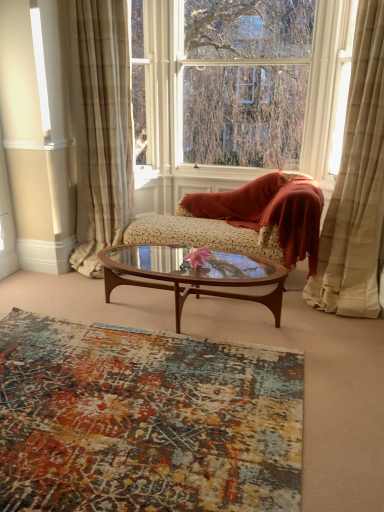
What do you see at coordinates (101, 128) in the screenshot? The height and width of the screenshot is (512, 384). I see `beige plaid curtain at left, the first curtain from the left` at bounding box center [101, 128].

What is the approximate height of beige textured curtain at right, which is the first curtain in right-to-left order?

It is 6.88 feet.

Describe the element at coordinates (144, 420) in the screenshot. This screenshot has height=512, width=384. I see `textured multicolored rug at lower center` at that location.

Where is `clear glass window at upper center`? Image resolution: width=384 pixels, height=512 pixels. clear glass window at upper center is located at coordinates (238, 90).

This screenshot has height=512, width=384. Describe the element at coordinates (248, 219) in the screenshot. I see `velvet floral-patterned chaise lounge at center` at that location.

Locate an element on the screen. This screenshot has width=384, height=512. beige plaid curtain at left, the first curtain from the left is located at coordinates (101, 128).

From the picture: Can you confirm if brown wood/glass coffee table at center is positioned to the left of clear glass window at upper center?

Correct, you'll find brown wood/glass coffee table at center to the left of clear glass window at upper center.

Measure the distance between brown wood/glass coffee table at center and clear glass window at upper center.

brown wood/glass coffee table at center and clear glass window at upper center are 4.52 feet apart from each other.

Considering the relative sizes of brown wood/glass coffee table at center and clear glass window at upper center in the image provided, is brown wood/glass coffee table at center thinner than clear glass window at upper center?

Incorrect, the width of brown wood/glass coffee table at center is not less than that of clear glass window at upper center.

Is brown wood/glass coffee table at center touching clear glass window at upper center?

No, brown wood/glass coffee table at center is not in contact with clear glass window at upper center.

Between velvet floral-patterned chaise lounge at center and brown wood/glass coffee table at center, which one has more height?

velvet floral-patterned chaise lounge at center.

Which object is further away from the camera taking this photo, velvet floral-patterned chaise lounge at center or brown wood/glass coffee table at center?

velvet floral-patterned chaise lounge at center is more distant.

Consider the image. Is velvet floral-patterned chaise lounge at center looking in the opposite direction of brown wood/glass coffee table at center?

No, velvet floral-patterned chaise lounge at center is not facing the opposite direction of brown wood/glass coffee table at center.

Is velvet floral-patterned chaise lounge at center bigger than brown wood/glass coffee table at center?

Yes.

Is clear glass window at upper center with textured multicolored rug at lower center?

No, clear glass window at upper center is not with textured multicolored rug at lower center.

Can you tell me how much clear glass window at upper center and textured multicolored rug at lower center differ in facing direction?

clear glass window at upper center and textured multicolored rug at lower center are facing 90.1 degrees away from each other.

Is clear glass window at upper center facing towards textured multicolored rug at lower center?

Yes, clear glass window at upper center faces towards textured multicolored rug at lower center.

Would you say brown wood/glass coffee table at center is outside velvet floral-patterned chaise lounge at center?

Absolutely, brown wood/glass coffee table at center is external to velvet floral-patterned chaise lounge at center.

Does point (181, 285) come farther from viewer compared to point (290, 263)?

Yes, point (181, 285) is behind point (290, 263).

Is brown wood/glass coffee table at center oriented away from velvet floral-patterned chaise lounge at center?

Absolutely, brown wood/glass coffee table at center is directed away from velvet floral-patterned chaise lounge at center.

Is brown wood/glass coffee table at center bigger than velvet floral-patterned chaise lounge at center?

No.

From a real-world perspective, between beige textured curtain at right, acting as the second curtain starting from the left, and velvet floral-patterned chaise lounge at center, who is vertically lower?

velvet floral-patterned chaise lounge at center.

Can you confirm if beige textured curtain at right, which is the first curtain in right-to-left order, is wider than velvet floral-patterned chaise lounge at center?

Yes.

Is beige textured curtain at right, acting as the second curtain starting from the left, taller than velvet floral-patterned chaise lounge at center?

Indeed, beige textured curtain at right, acting as the second curtain starting from the left, has a greater height compared to velvet floral-patterned chaise lounge at center.

From the image's perspective, is beige textured curtain at right, which is the first curtain in right-to-left order, beneath velvet floral-patterned chaise lounge at center?

No, from the image's perspective, beige textured curtain at right, which is the first curtain in right-to-left order, is not below velvet floral-patterned chaise lounge at center.

Is brown wood/glass coffee table at center aimed at beige plaid curtain at left, the first curtain from the left?

No, brown wood/glass coffee table at center is not aimed at beige plaid curtain at left, the first curtain from the left.

Who is smaller, brown wood/glass coffee table at center or beige plaid curtain at left, which is the second curtain from right to left?

With smaller size is brown wood/glass coffee table at center.

From the image's perspective, is brown wood/glass coffee table at center under beige plaid curtain at left, the first curtain from the left?

Correct, brown wood/glass coffee table at center appears lower than beige plaid curtain at left, the first curtain from the left, in the image.

Is point (135, 169) more distant than point (117, 42)?

Yes.

Is clear glass window at upper center positioned far away from beige plaid curtain at left, the first curtain from the left?

Actually, clear glass window at upper center and beige plaid curtain at left, the first curtain from the left, are a little close together.

From the image's perspective, is clear glass window at upper center under beige plaid curtain at left, the first curtain from the left?

No, from the image's perspective, clear glass window at upper center is not beneath beige plaid curtain at left, the first curtain from the left.

Could you measure the distance between clear glass window at upper center and beige plaid curtain at left, the first curtain from the left?

A distance of 33.84 inches exists between clear glass window at upper center and beige plaid curtain at left, the first curtain from the left.

This screenshot has width=384, height=512. Identify the location of coffee table below the clear glass window at upper center (from the image's perspective). (194, 275).

The height and width of the screenshot is (512, 384). What are the coordinates of `coffee table on the left of velvet floral-patterned chaise lounge at center` in the screenshot? It's located at (194, 275).

Estimate the real-world distances between objects in this image. Which object is closer to clear glass window at upper center, brown wood/glass coffee table at center or beige textured curtain at right, acting as the second curtain starting from the left?

beige textured curtain at right, acting as the second curtain starting from the left.

Which object lies further to the anchor point clear glass window at upper center, textured multicolored rug at lower center or beige plaid curtain at left, the first curtain from the left?

Among the two, textured multicolored rug at lower center is located further to clear glass window at upper center.

Consider the image. Considering their positions, is brown wood/glass coffee table at center positioned further to beige plaid curtain at left, which is the second curtain from right to left, than textured multicolored rug at lower center?

The object further to beige plaid curtain at left, which is the second curtain from right to left, is textured multicolored rug at lower center.

When comparing their distances from beige textured curtain at right, which is the first curtain in right-to-left order, does brown wood/glass coffee table at center or clear glass window at upper center seem closer?

brown wood/glass coffee table at center lies closer to beige textured curtain at right, which is the first curtain in right-to-left order, than the other object.

From the image, which object appears to be farther from beige plaid curtain at left, the first curtain from the left, velvet floral-patterned chaise lounge at center or brown wood/glass coffee table at center?

Based on the image, velvet floral-patterned chaise lounge at center appears to be further to beige plaid curtain at left, the first curtain from the left.

Based on their spatial positions, is beige textured curtain at right, acting as the second curtain starting from the left, or velvet floral-patterned chaise lounge at center closer to textured multicolored rug at lower center?

velvet floral-patterned chaise lounge at center is closer to textured multicolored rug at lower center.

Looking at the image, which one is located further to textured multicolored rug at lower center, clear glass window at upper center or beige textured curtain at right, which is the first curtain in right-to-left order?

clear glass window at upper center is further to textured multicolored rug at lower center.

From the image, which object appears to be farther from velvet floral-patterned chaise lounge at center, clear glass window at upper center or beige textured curtain at right, acting as the second curtain starting from the left?

Based on the image, clear glass window at upper center appears to be further to velvet floral-patterned chaise lounge at center.

Where is `plain between beige plaid curtain at left, the first curtain from the left, and beige textured curtain at right, which is the first curtain in right-to-left order, from left to right`? The height and width of the screenshot is (512, 384). plain between beige plaid curtain at left, the first curtain from the left, and beige textured curtain at right, which is the first curtain in right-to-left order, from left to right is located at coordinates (144, 420).

Where is `studio couch between clear glass window at upper center and textured multicolored rug at lower center in the vertical direction`? Image resolution: width=384 pixels, height=512 pixels. studio couch between clear glass window at upper center and textured multicolored rug at lower center in the vertical direction is located at coordinates (248, 219).

At what (x,y) coordinates should I click in order to perform the action: click on coffee table between beige plaid curtain at left, which is the second curtain from right to left, and beige textured curtain at right, which is the first curtain in right-to-left order, from left to right. Please return your answer as a coordinate pair (x, y). Looking at the image, I should click on (194, 275).

At what (x,y) coordinates should I click in order to perform the action: click on coffee table between textured multicolored rug at lower center and beige textured curtain at right, acting as the second curtain starting from the left, from left to right. Please return your answer as a coordinate pair (x, y). The width and height of the screenshot is (384, 512). Looking at the image, I should click on (194, 275).